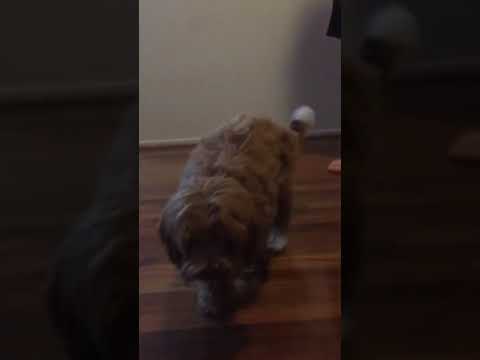
Image resolution: width=480 pixels, height=360 pixels. What are the coordinates of `brown flooring` in the screenshot? It's located at (314, 301).